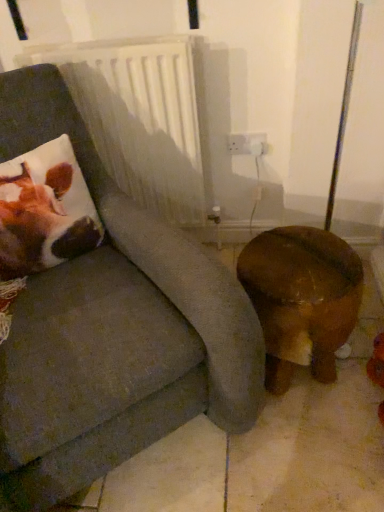
Question: Does point (6, 221) appear closer or farther from the camera than point (112, 461)?

Choices:
 (A) closer
 (B) farther

Answer: (B)

Question: From a real-world perspective, is brown plush cushion at left physically located above or below suede-like gray chair at left?

Choices:
 (A) above
 (B) below

Answer: (A)

Question: Which is nearer to the brown wooden stool at lower right?

Choices:
 (A) suede-like gray chair at left
 (B) white plastic radiator at upper center
 (C) brown plush cushion at left

Answer: (A)

Question: Estimate the real-world distances between objects in this image. Which object is closer to the brown plush cushion at left?

Choices:
 (A) white plastic radiator at upper center
 (B) suede-like gray chair at left
 (C) brown wooden stool at lower right

Answer: (B)